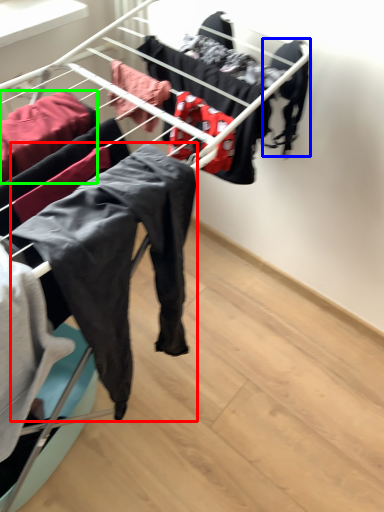
Question: Considering the real-world distances, which object is farthest from clothing (highlighted by a red box)? clothing (highlighted by a blue box) or clothing (highlighted by a green box)?

Choices:
 (A) clothing
 (B) clothing

Answer: (A)